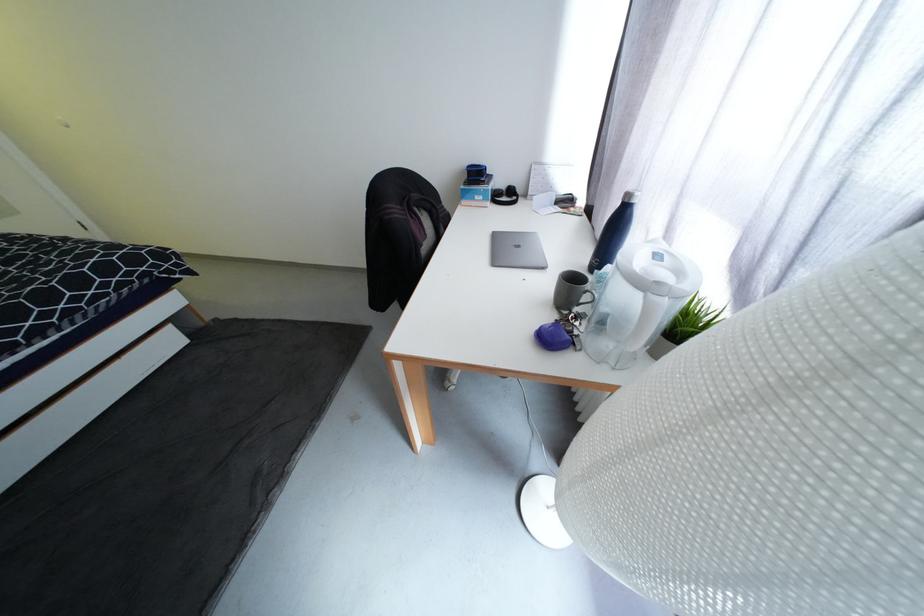
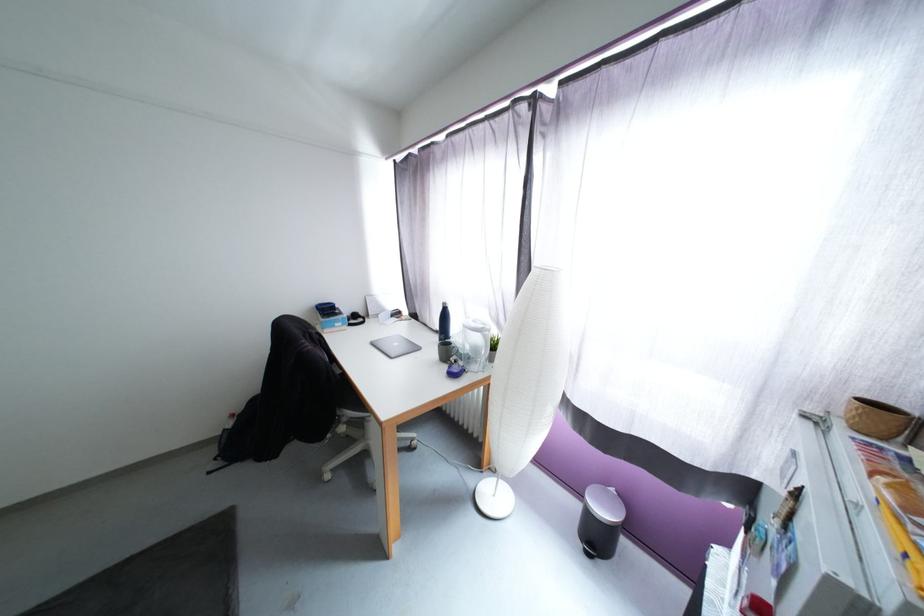
Question: The images are taken continuously from a first-person perspective. In which direction is your viewpoint rotating?

Choices:
 (A) Left
 (B) Right
 (C) Up
 (D) Down

Answer: (B)